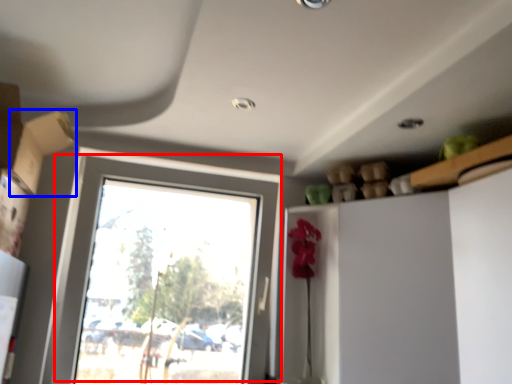
Question: Which object appears farthest to the camera in this image, window (highlighted by a red box) or cardboard box (highlighted by a blue box)?

Choices:
 (A) window
 (B) cardboard box

Answer: (A)